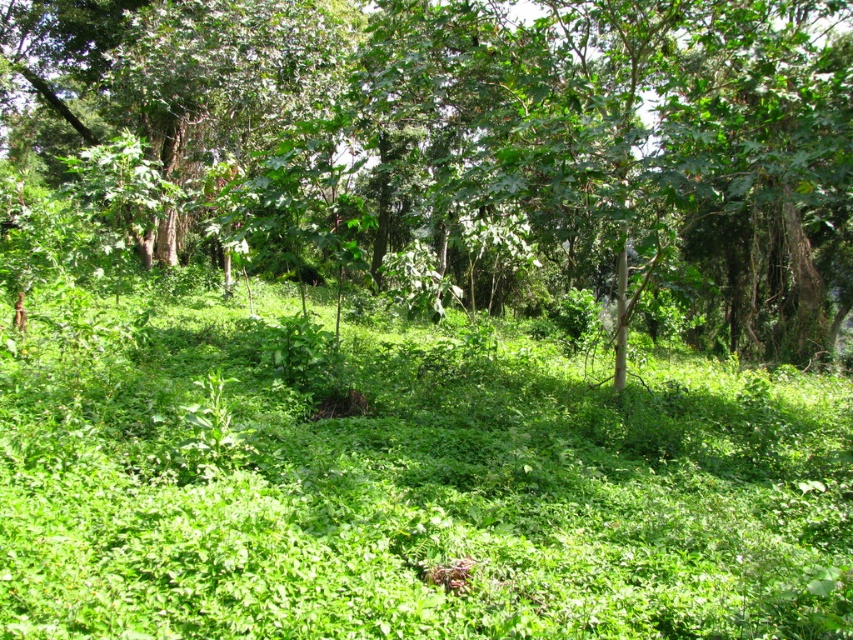
You are navigating through the forest and want to reach a hidden treasure located at point (589, 292). There is an obstacle at point (321, 566) blocking your path. Can you go around it to reach the treasure?

Point (321, 566) is in front of point (589, 292), so you cannot go around it directly. You need to find an alternative path that avoids the obstacle at point (321, 566).